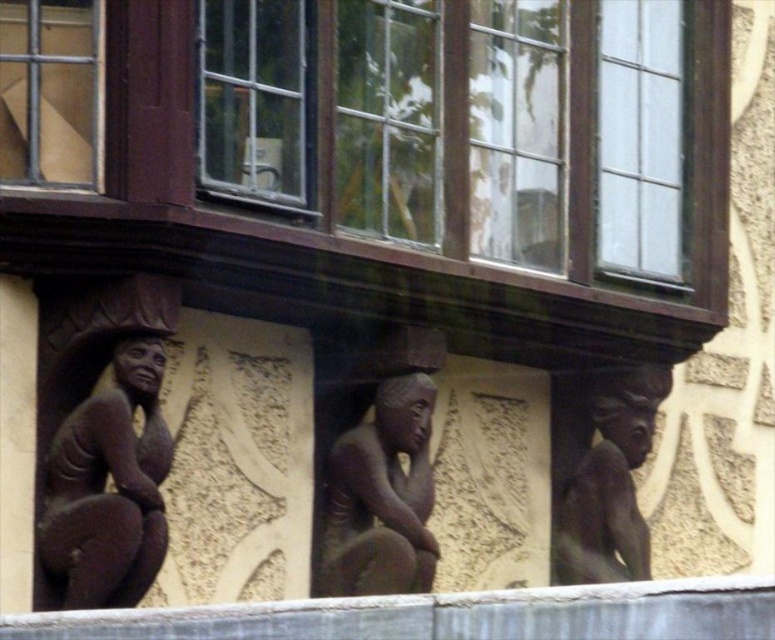
Is brown stone window at center positioned before brown stone figure at right?

Yes, it is in front of brown stone figure at right.

Does brown stone window at center come behind brown stone figure at right?

That is False.

Where is `brown stone window at center`? brown stone window at center is located at coordinates (393, 160).

Image resolution: width=775 pixels, height=640 pixels. What are the coordinates of `brown stone window at center` in the screenshot? It's located at (393, 160).

Between brown stone window at center and brown stone figure at center, which one appears on the left side from the viewer's perspective?

Positioned to the left is brown stone figure at center.

Can you confirm if brown stone window at center is shorter than brown stone figure at center?

No, brown stone window at center is not shorter than brown stone figure at center.

Which is behind, point (360, 60) or point (367, 577)?

Point (360, 60)

Find the location of a particular element. The height and width of the screenshot is (640, 775). brown stone window at center is located at coordinates (393, 160).

Is clear glass window at upper center smaller than matte glass window at upper left?

Actually, clear glass window at upper center might be larger than matte glass window at upper left.

Does clear glass window at upper center appear on the left side of matte glass window at upper left?

Incorrect, clear glass window at upper center is not on the left side of matte glass window at upper left.

I want to click on clear glass window at upper center, so click(x=253, y=99).